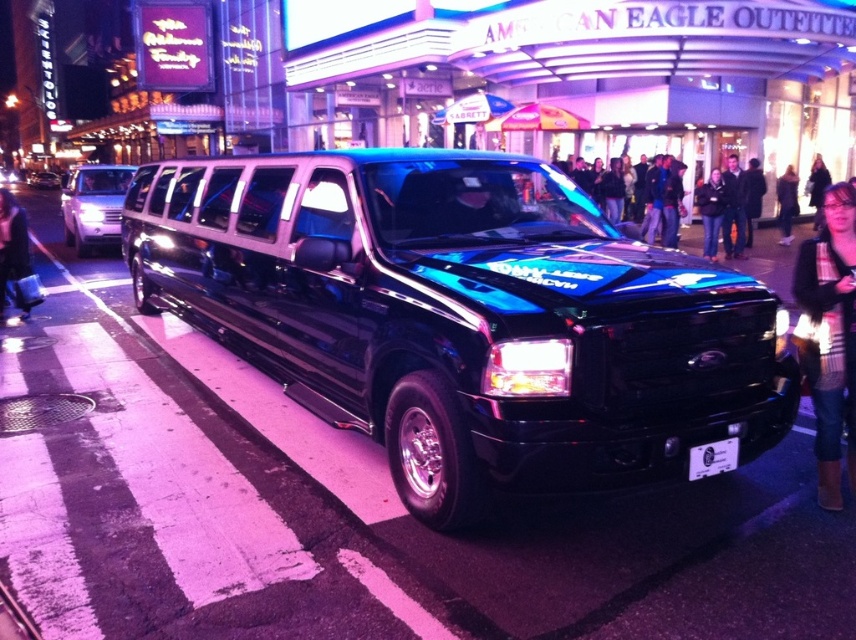
You are a delivery driver who needs to park your vehicle near the American Eagle Outfitters storefront. The parking spot you want is directly in front of the metallic silver suv at left. Based on the SUVs position, can you estimate if there is enough space to park your vehicle between the SUV and the storefront?

The metallic silver suv at left is located at point [93,205], which indicates its position relative to the storefront. However, without specific distance measurements between the SUV and the storefront, it is impossible to accurately determine if there is sufficient space for your vehicle. You should check the available parking area physically or consult a map for precise dimensions.

You are a parking attendant who needs to fit both the black glossy limousine at center and the metallic blue car at center into a parking spot that can only accommodate vehicles up to 4.5 meters in length. Given their sizes, which vehicle should be prioritized to fit into the spot first?

The black glossy limousine at center is shorter than the metallic blue car at center, so the metallic blue car at center may not fit into the 4.5 meter spot. The limousine should be prioritized as it is shorter and more likely to fit.

You are a pedestrian standing at the curb and want to cross the street to reach the American Eagle Outfitters store. The metallic silver suv at left is blocking your path. Can you walk around it to get to the white plastic license plate at center?

The metallic silver suv at left is 15.06 meters away from the white plastic license plate at center. Since the distance between them is quite large, you can walk around the metallic silver suv at left to reach the white plastic license plate at center.